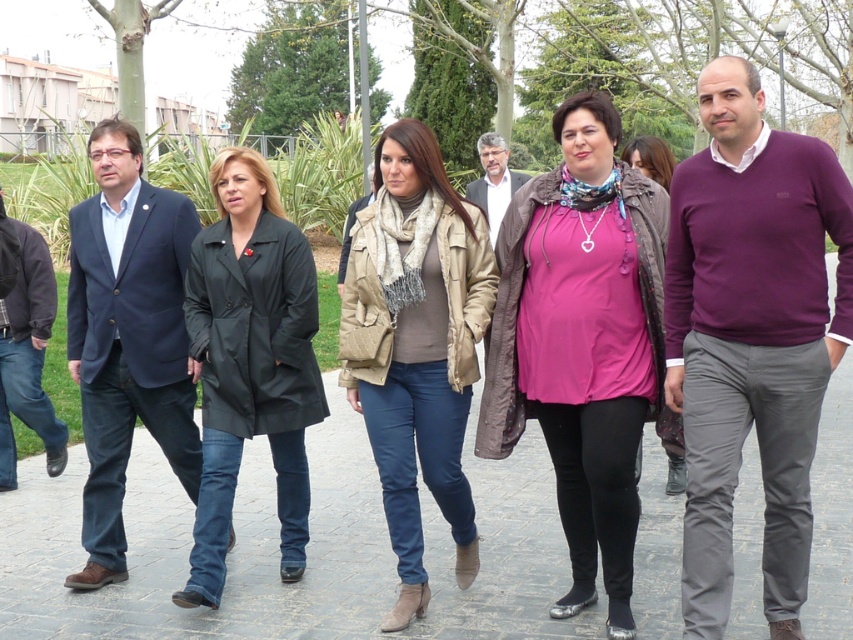
Does purple sweater at center have a lesser height compared to dark gray suit at center?

Incorrect, purple sweater at center's height does not fall short of dark gray suit at center's.

Measure the distance between purple sweater at center and camera.

They are 12.80 feet apart.

At what (x,y) coordinates should I click in order to perform the action: click on purple sweater at center. Please return your answer as a coordinate pair (x, y). The image size is (853, 640). Looking at the image, I should click on 751,337.

Between gray concrete pavement at center and pink matte shirt at center, which one appears on the right side from the viewer's perspective?

Positioned to the right is pink matte shirt at center.

Who is higher up, gray concrete pavement at center or pink matte shirt at center?

pink matte shirt at center

Who is more forward, (x=431, y=540) or (x=541, y=253)?

Point (x=541, y=253) is more forward.

The width and height of the screenshot is (853, 640). Identify the location of gray concrete pavement at center. (306, 548).

Is gray concrete pavement at center thinner than beige textured vest at center?

No, gray concrete pavement at center is not thinner than beige textured vest at center.

Is gray concrete pavement at center shorter than beige textured vest at center?

Correct, gray concrete pavement at center is not as tall as beige textured vest at center.

You are a GUI agent. You are given a task and a screenshot of the screen. Output one action in this format:
    pyautogui.click(x=<x>, y=<y>)
    Task: Click on the gray concrete pavement at center
    
    Given the screenshot: What is the action you would take?
    pyautogui.click(x=306, y=548)